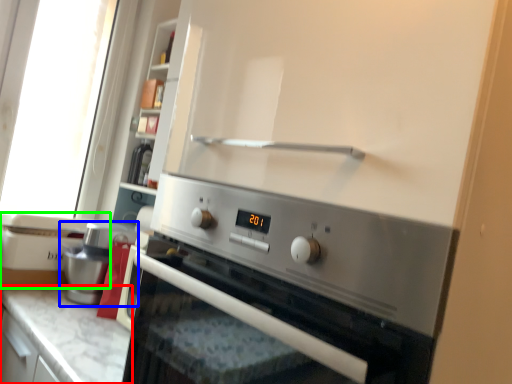
Question: Considering the real-world distances, which object is closest to countertop (highlighted by a red box)? coffee machine (highlighted by a blue box) or appliance (highlighted by a green box).

Choices:
 (A) coffee machine
 (B) appliance

Answer: (A)